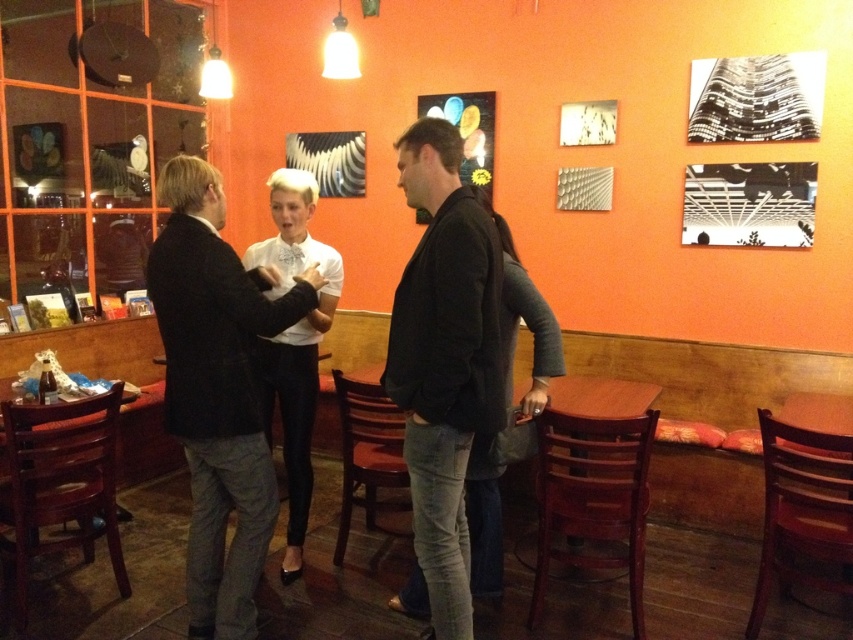
Is black matte jacket at center wider than wooden table at center?

No.

Can you confirm if black matte jacket at center is smaller than wooden table at center?

No.

Locate an element on the screen. The height and width of the screenshot is (640, 853). black matte jacket at center is located at coordinates (444, 358).

The height and width of the screenshot is (640, 853). I want to click on black matte jacket at center, so click(x=444, y=358).

Does dark gray suit at center have a lesser width compared to black matte jacket at center?

Incorrect, dark gray suit at center's width is not less than black matte jacket at center's.

In the scene shown: Can you confirm if dark gray suit at center is wider than black matte jacket at center?

Indeed, dark gray suit at center has a greater width compared to black matte jacket at center.

The width and height of the screenshot is (853, 640). I want to click on dark gray suit at center, so click(218, 390).

Describe the element at coordinates (444, 358) in the screenshot. This screenshot has width=853, height=640. I see `black matte jacket at center` at that location.

Where is `black matte jacket at center`? black matte jacket at center is located at coordinates (444, 358).